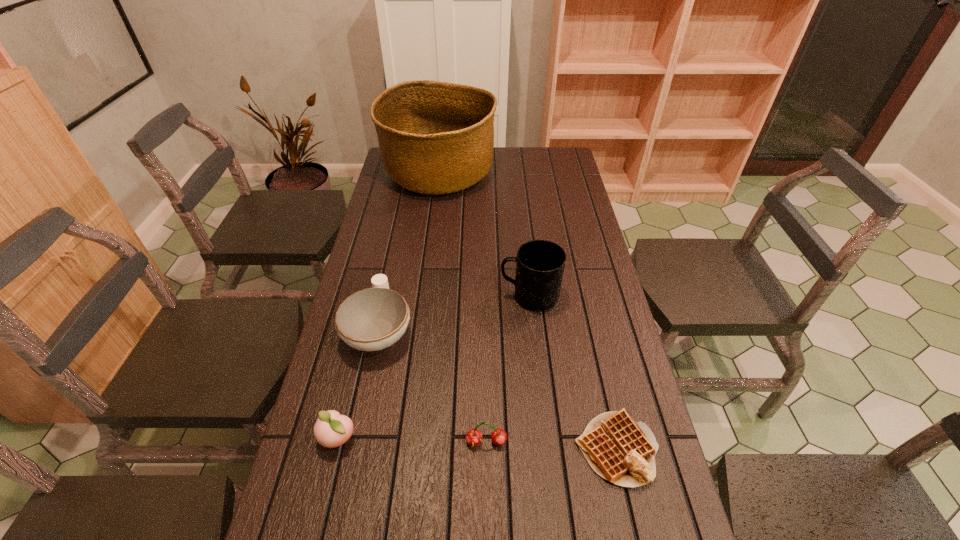
Locate an element on the screen. peach that is at the left edge is located at coordinates (331, 429).

You are a GUI agent. You are given a task and a screenshot of the screen. Output one action in this format:
    pyautogui.click(x=<x>, y=<y>)
    Task: Click on the mug situated at the right edge
    The width and height of the screenshot is (960, 540).
    Given the screenshot: What is the action you would take?
    pyautogui.click(x=540, y=264)

The width and height of the screenshot is (960, 540). In order to click on waffle positioned at the right edge in this screenshot , I will do `click(620, 450)`.

Find the location of a particular element. object situated at the far left corner is located at coordinates (435, 138).

Where is `free space at the far edge`? This screenshot has height=540, width=960. free space at the far edge is located at coordinates (524, 163).

Find the location of a particular element. The height and width of the screenshot is (540, 960). vacant space at the left edge of the desktop is located at coordinates (405, 215).

Where is `vacant position at the right edge of the desktop`? vacant position at the right edge of the desktop is located at coordinates (651, 537).

Where is `free region at the far right corner of the desktop`? This screenshot has width=960, height=540. free region at the far right corner of the desktop is located at coordinates (560, 155).

Identify the location of free area in between the cherry and the chinaware. (433, 386).

At what (x,y) coordinates should I click in order to perform the action: click on vacant area between the tallest object and the cherry. Please return your answer as a coordinate pair (x, y). This screenshot has height=540, width=960. Looking at the image, I should click on (463, 308).